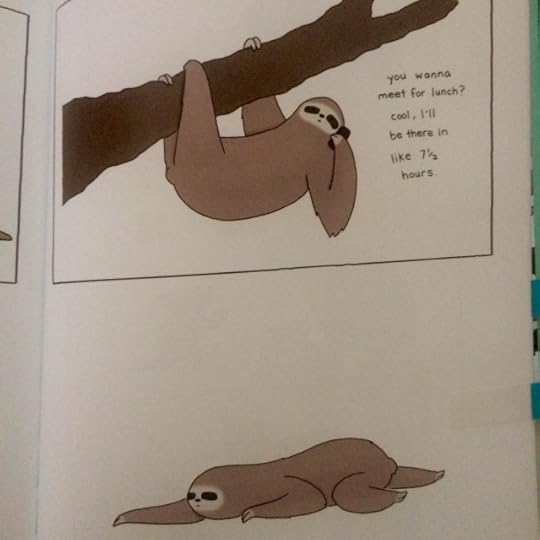
At what (x,y) coordinates should I click in order to perform the action: click on brown text and words on wall. Please return your answer as a coordinate pair (x, y). Image resolution: width=540 pixels, height=540 pixels. Looking at the image, I should click on (417, 126).